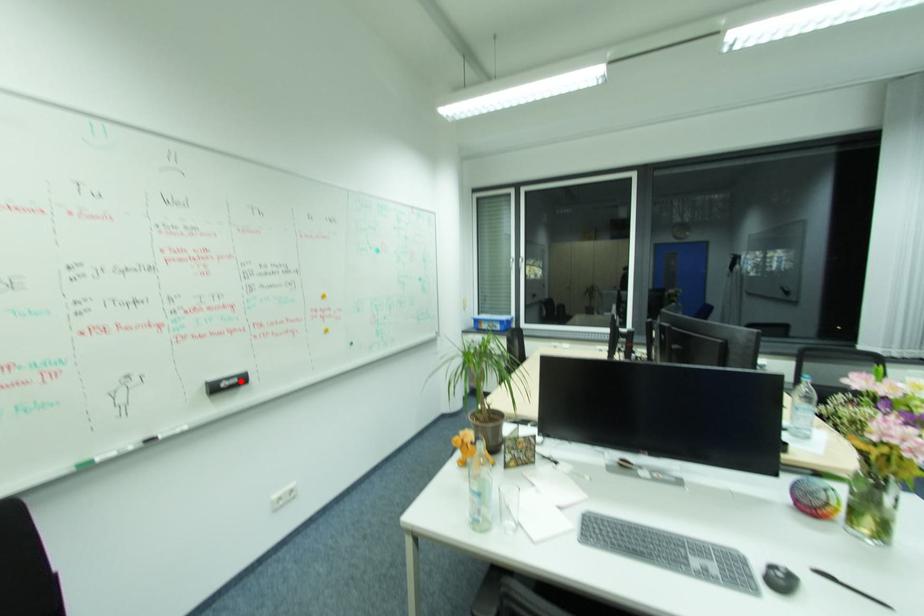
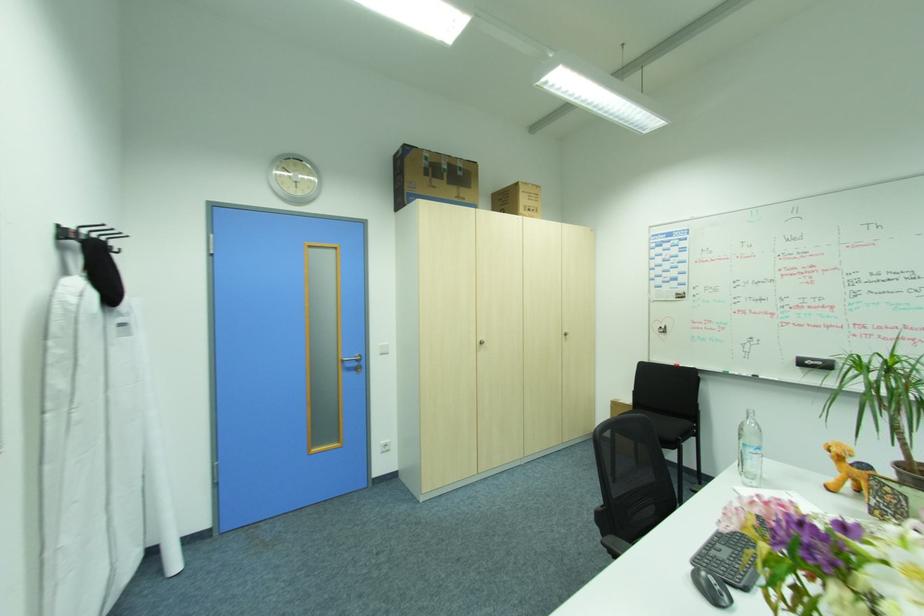
Where in the second image is the point corresponding to the highlighted location from the first image?

(824, 363)